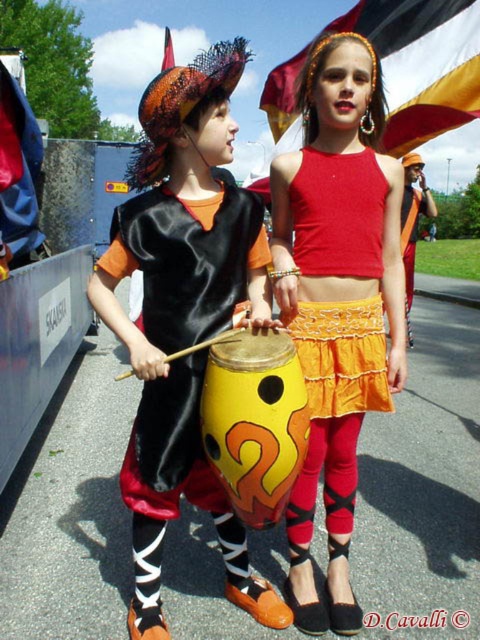
Consider the image. Is black satin drum at center to the right of orange lace skirt at center from the viewer's perspective?

Incorrect, black satin drum at center is not on the right side of orange lace skirt at center.

Is black satin drum at center to the left of orange lace skirt at center from the viewer's perspective?

Correct, you'll find black satin drum at center to the left of orange lace skirt at center.

Where is `black satin drum at center`? black satin drum at center is located at coordinates (188, 259).

Which is behind, point (304, 308) or point (169, 61)?

The point (169, 61) is behind.

Is point (347, 227) positioned before point (168, 51)?

Yes, it is in front of point (168, 51).

Between point (302, 177) and point (164, 61), which one is positioned behind?

The point (164, 61) is behind.

Locate an element on the screen. This screenshot has height=640, width=480. orange lace skirt at center is located at coordinates tap(337, 216).

Can you confirm if yellow matte drum at center is smaller than red fabric flag at upper center?

Yes.

Can you confirm if yellow matte drum at center is positioned below red fabric flag at upper center?

Yes.

Is point (201, 420) less distant than point (168, 61)?

Yes, point (201, 420) is closer to viewer.

You are a GUI agent. You are given a task and a screenshot of the screen. Output one action in this format:
    pyautogui.click(x=<x>, y=<y>)
    Task: Click on the yellow matte drum at center
    The height and width of the screenshot is (640, 480).
    Given the screenshot: What is the action you would take?
    pyautogui.click(x=254, y=419)